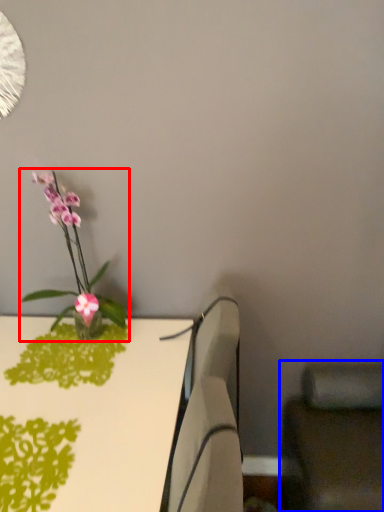
Question: Which point is further to the camera, houseplant (highlighted by a red box) or swivel chair (highlighted by a blue box)?

Choices:
 (A) houseplant
 (B) swivel chair

Answer: (A)